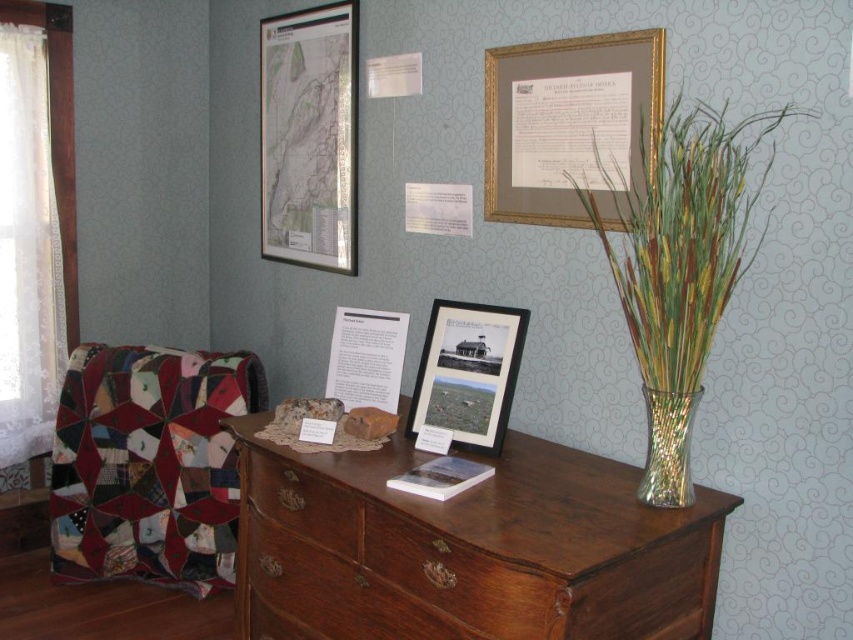
Is dark brown wood drawer at center below translucent glass vase at right?

Indeed, dark brown wood drawer at center is positioned under translucent glass vase at right.

Measure the distance between dark brown wood drawer at center and camera.

They are 4.23 feet apart.

The image size is (853, 640). Describe the element at coordinates (459, 577) in the screenshot. I see `dark brown wood drawer at center` at that location.

At what (x,y) coordinates should I click in order to perform the action: click on dark brown wood drawer at center. Please return your answer as a coordinate pair (x, y). The height and width of the screenshot is (640, 853). Looking at the image, I should click on (459, 577).

Is patchwork fabric quilt at left above translucent glass vase at right?

No.

From the picture: Between patchwork fabric quilt at left and translucent glass vase at right, which one is positioned lower?

Positioned lower is patchwork fabric quilt at left.

Between point (200, 412) and point (672, 481), which one is positioned behind?

Positioned behind is point (200, 412).

The image size is (853, 640). I want to click on patchwork fabric quilt at left, so click(x=149, y=464).

Does wooden dresser at center have a smaller size compared to matte paper map at upper left?

Incorrect, wooden dresser at center is not smaller in size than matte paper map at upper left.

Between point (705, 595) and point (280, 129), which one is positioned behind?

Point (280, 129)

Is point (426, 563) in front of point (334, 209)?

Yes.

I want to click on wooden dresser at center, so click(467, 548).